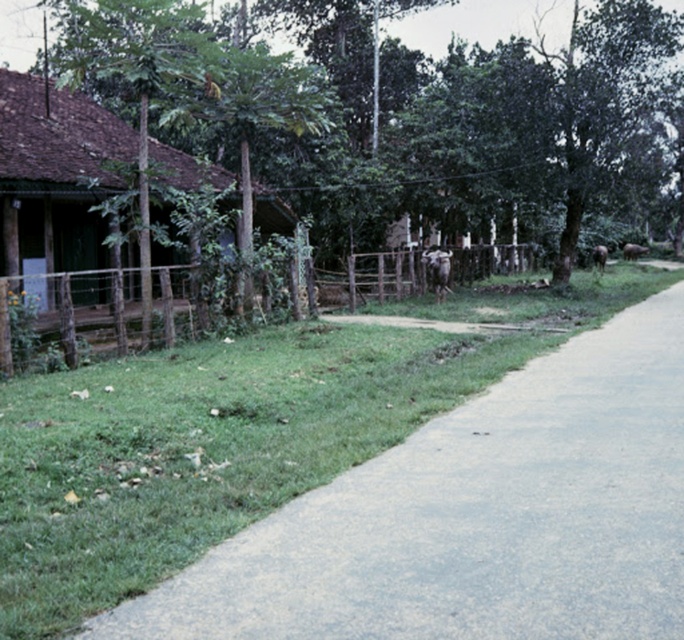
Question: Considering the real-world distances, which object is farthest from the brown thatched hut at left?

Choices:
 (A) brown furry cow at right
 (B) brown furry cow at center-right
 (C) brown furry cow at center

Answer: (A)

Question: Is brown thatched hut at left above brown furry cow at center?

Choices:
 (A) yes
 (B) no

Answer: (A)

Question: Is brown thatched hut at left wider than brown furry cow at center-right?

Choices:
 (A) no
 (B) yes

Answer: (B)

Question: Which point is farther to the camera?

Choices:
 (A) brown furry cow at right
 (B) brown thatched hut at left

Answer: (A)

Question: Does brown thatched hut at left have a larger size compared to brown furry cow at right?

Choices:
 (A) yes
 (B) no

Answer: (A)

Question: Which object is farther from the camera taking this photo?

Choices:
 (A) brown thatched hut at left
 (B) brown furry cow at right
 (C) brown furry cow at center-right

Answer: (B)